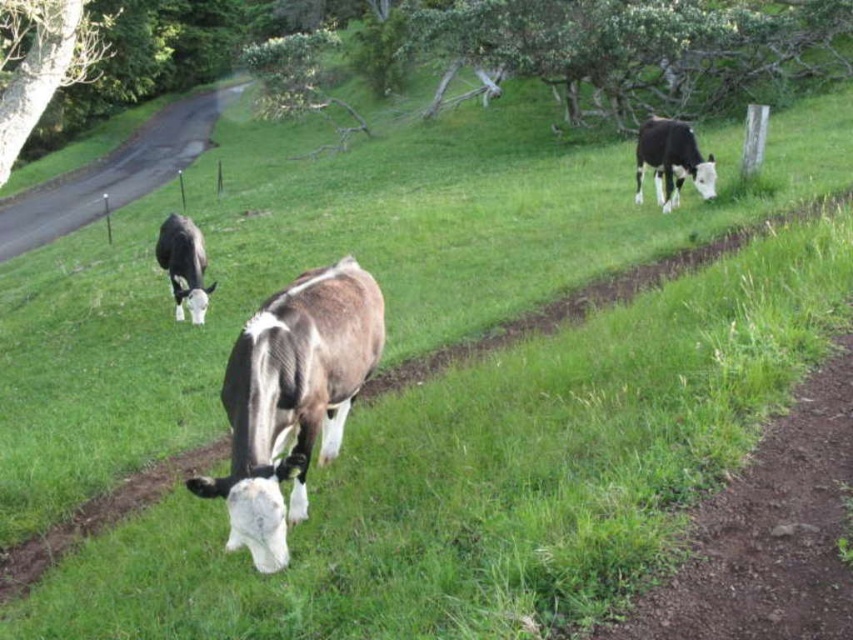
You are standing at the point marked by the coordinates (291, 397) in the image. Looking around, you see a brown glossy cow at center. Which direction should you walk to reach the road on the left side of the image?

Since the point (291, 397) is marked as the brown glossy cow at center, you are currently at the cow. To reach the road on the left side, you need to walk towards the left direction from the cow.

In the serene rural scene with three cows grazing in a lush green field, where the brown glossy cow at center is located, can you specify its exact position using the coordinate system provided?

The brown glossy cow at center is located at point (291, 397).

You are a farmer checking the field layout. You need to know if the brown glossy cow at center is currently in a position where it might be hit by a vehicle coming from the asphalt road at left. Based on their positions, is the cow in a safe location?

The brown glossy cow at center is positioned under the asphalt road at left, meaning it is directly beneath the road. This placement suggests the cow is on or near the road, which would put it in danger of being hit by vehicles. Therefore, the cow is not in a safe location.